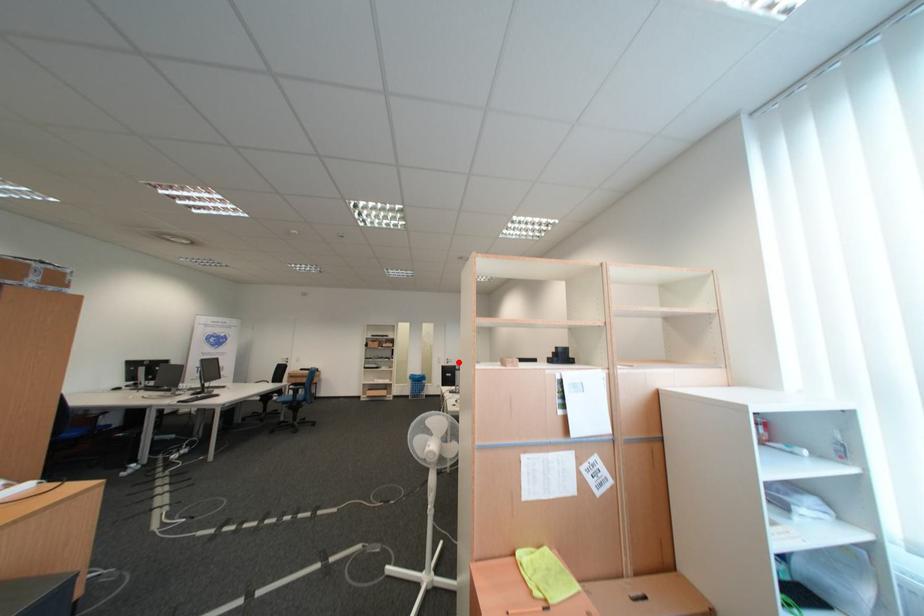
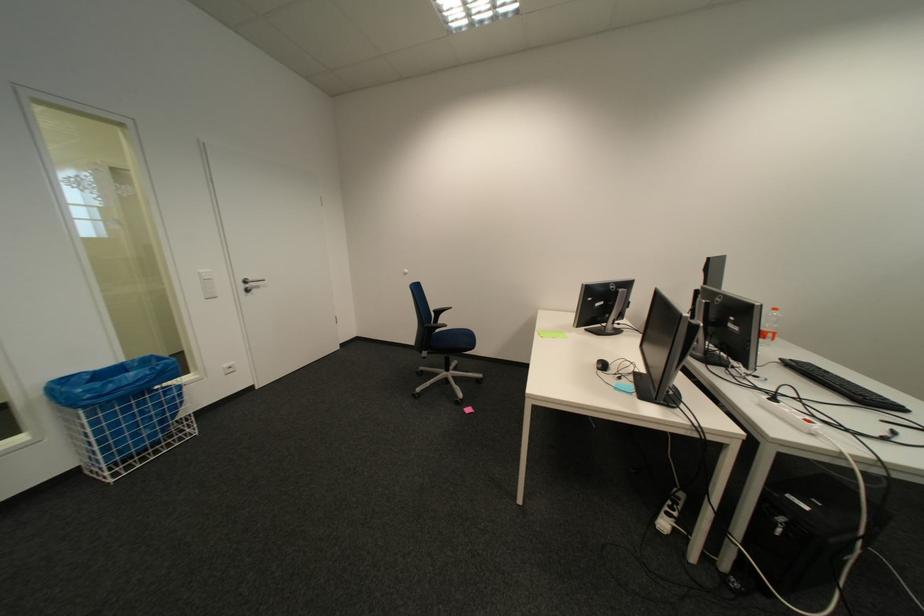
The point at the highlighted location is marked in the first image. Where is the corresponding point in the second image?

(254, 286)